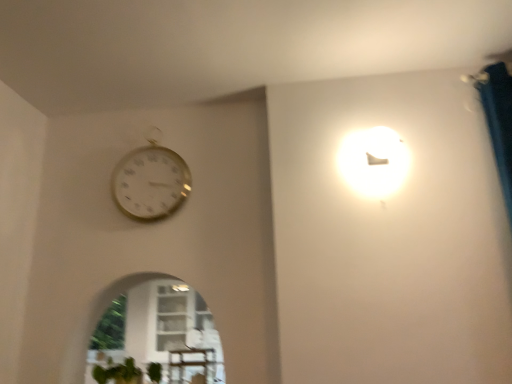
Question: Should I look upward or downward to see gold metallic wall clock at upper left?

Choices:
 (A) down
 (B) up

Answer: (B)

Question: Is wooden table at lower center to the left of gold metallic wall clock at upper left from the viewer's perspective?

Choices:
 (A) no
 (B) yes

Answer: (A)

Question: From a real-world perspective, does wooden table at lower center sit lower than gold metallic wall clock at upper left?

Choices:
 (A) yes
 (B) no

Answer: (A)

Question: Is wooden table at lower center not close to gold metallic wall clock at upper left?

Choices:
 (A) yes
 (B) no

Answer: (B)

Question: Is wooden table at lower center facing towards gold metallic wall clock at upper left?

Choices:
 (A) yes
 (B) no

Answer: (B)

Question: Considering the relative positions of wooden table at lower center and gold metallic wall clock at upper left in the image provided, is wooden table at lower center to the right of gold metallic wall clock at upper left from the viewer's perspective?

Choices:
 (A) no
 (B) yes

Answer: (B)

Question: Are wooden table at lower center and gold metallic wall clock at upper left beside each other?

Choices:
 (A) yes
 (B) no

Answer: (B)

Question: Considering the relative sizes of gold metallic wall clock at upper left and green matte plant at lower left in the image provided, is gold metallic wall clock at upper left wider than green matte plant at lower left?

Choices:
 (A) no
 (B) yes

Answer: (A)

Question: From a real-world perspective, does gold metallic wall clock at upper left sit lower than green matte plant at lower left?

Choices:
 (A) no
 (B) yes

Answer: (A)

Question: Is gold metallic wall clock at upper left shorter than green matte plant at lower left?

Choices:
 (A) yes
 (B) no

Answer: (B)

Question: Considering the relative sizes of gold metallic wall clock at upper left and green matte plant at lower left in the image provided, is gold metallic wall clock at upper left thinner than green matte plant at lower left?

Choices:
 (A) yes
 (B) no

Answer: (A)

Question: Does gold metallic wall clock at upper left have a greater height compared to green matte plant at lower left?

Choices:
 (A) yes
 (B) no

Answer: (A)

Question: Is gold metallic wall clock at upper left smaller than green matte plant at lower left?

Choices:
 (A) no
 (B) yes

Answer: (A)

Question: Is wooden table at lower center outside of green matte plant at lower left?

Choices:
 (A) no
 (B) yes

Answer: (B)